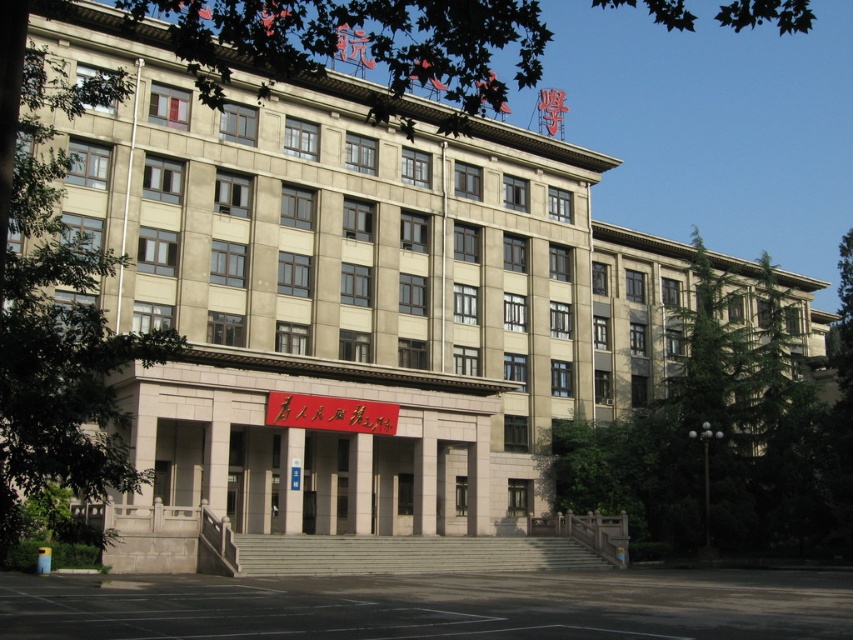
From the picture: You are standing in front of the building and want to take a photo that includes both the green leafy tree at right and the green leafy tree at left. Which tree should you move closer to in order to include both trees in the frame?

To include both the green leafy tree at right and the green leafy tree at left in the frame, you should move closer to the green leafy tree at left since it is smaller and requires less space in the photo.

You are standing at the center of the building entrance. Looking towards the green leafy tree at right, in which direction should you walk to reach it? Please answer with either left, right, forward, or backward.

The green leafy tree at right is located at coordinates 0.683 on the x axis and 0.848 on the y axis. Since you are at the center of the entrance, which is at the lower part of the image, moving towards higher y coordinates means moving forward. The tree is to your right because its x coordinate is 0.683, which is to the right of the entrance. Therefore, you should walk forward and to the right to reach the green leafy tree at right.

You are standing in front of the building and want to compare the two green leafy trees in the scene. Which tree has a wider spread, the green leafy tree at right or the green leafy tree at upper center?

The green leafy tree at upper center has a wider spread than the green leafy tree at right, as the latter is narrower in width.